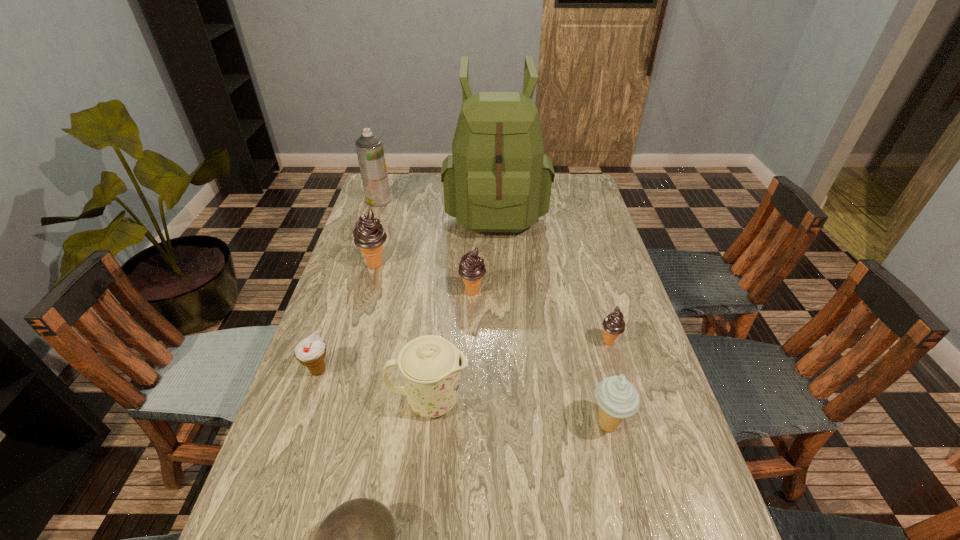
Find the location of a particular element. The width and height of the screenshot is (960, 540). vacant space that is in between the farthest icecream and the second farthest chocolate icecream is located at coordinates (424, 278).

The height and width of the screenshot is (540, 960). Find the location of `free space between the second chocolate icecream from right to left and the green backpack`. free space between the second chocolate icecream from right to left and the green backpack is located at coordinates (484, 250).

I want to click on free space between the biggest chocolate icecream and the fourth farthest icecream, so 347,318.

Find the location of a particular element. The image size is (960, 540). empty location between the green backpack and the aerosol can is located at coordinates (437, 204).

At what (x,y) coordinates should I click in order to perform the action: click on object that stands as the third closest to the smallest chocolate icecream. Please return your answer as a coordinate pair (x, y). Looking at the image, I should click on (431, 365).

Where is `object identified as the eighth closest to the smallest chocolate icecream`? object identified as the eighth closest to the smallest chocolate icecream is located at coordinates (369, 147).

At what (x,y) coordinates should I click in order to perform the action: click on icecream that is the fifth closest to the chinaware. Please return your answer as a coordinate pair (x, y). Image resolution: width=960 pixels, height=540 pixels. Looking at the image, I should click on (369, 234).

In order to click on the fourth closest icecream relative to the tallest icecream in this screenshot , I will do `click(617, 398)`.

Identify the location of chocolate icecream identified as the second closest to the fifth nearest object. Image resolution: width=960 pixels, height=540 pixels. click(x=369, y=234).

Locate an element on the screen. Image resolution: width=960 pixels, height=540 pixels. the closest chocolate icecream to the white icecream is located at coordinates (369, 234).